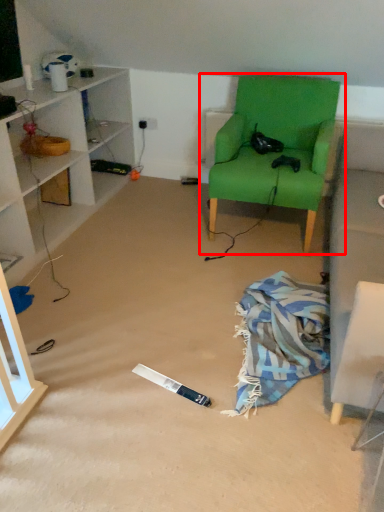
Question: From the image's perspective, considering the relative positions of chair (annotated by the red box) and blanket in the image provided, where is chair (annotated by the red box) located with respect to the staircase?

Choices:
 (A) above
 (B) below

Answer: (A)